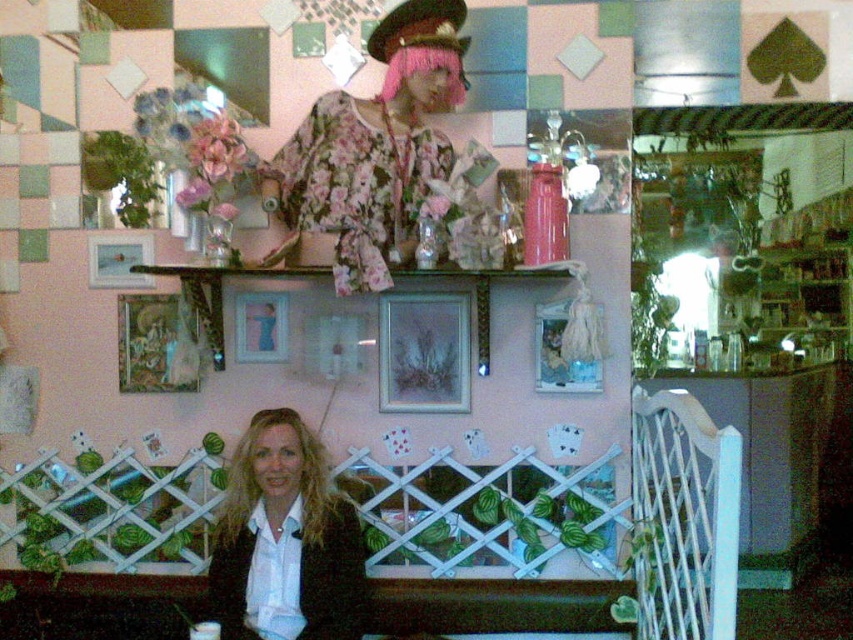
Who is higher up, floral fabric kimono at upper center or matte blue picture frame at center?

floral fabric kimono at upper center is above.

Does point (306, 180) come behind point (251, 323)?

No, (306, 180) is in front of (251, 323).

The width and height of the screenshot is (853, 640). What are the coordinates of `floral fabric kimono at upper center` in the screenshot? It's located at (373, 148).

I want to click on floral fabric kimono at upper center, so click(373, 148).

Is point (430, 321) more distant than point (115, 241)?

No, (430, 321) is closer to viewer.

Is metallic silver frame at center below matte silver picture frame at upper center?

Yes, metallic silver frame at center is below matte silver picture frame at upper center.

Image resolution: width=853 pixels, height=640 pixels. I want to click on metallic silver frame at center, so click(422, 353).

Identify the location of white matte shirt at lower center. The image size is (853, 640). (283, 540).